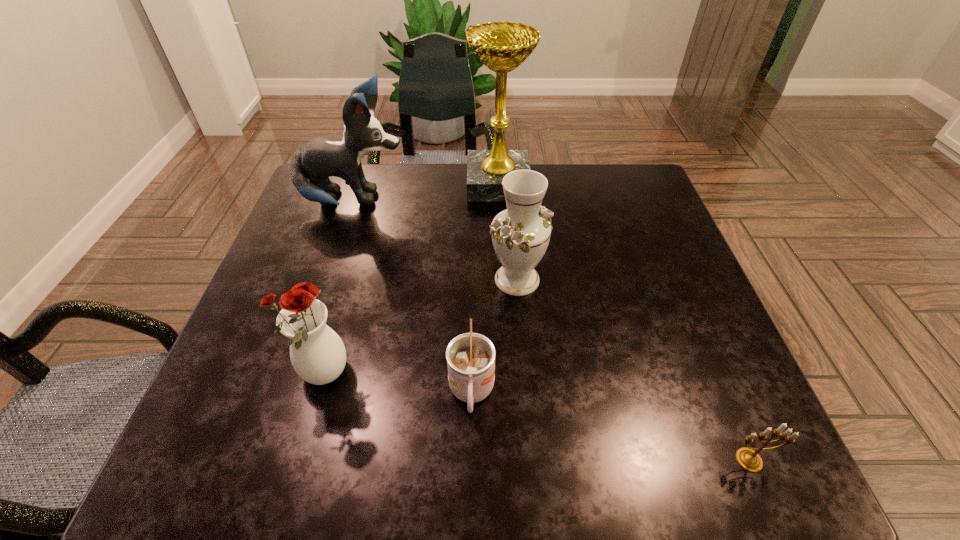
Identify the location of puppy that is positioned at the left edge. This screenshot has height=540, width=960. (313, 163).

Where is `vase that is at the left edge`? The height and width of the screenshot is (540, 960). vase that is at the left edge is located at coordinates (317, 353).

You are a GUI agent. You are given a task and a screenshot of the screen. Output one action in this format:
    pyautogui.click(x=<x>, y=<y>)
    Task: Click on the object situated at the right edge
    The image size is (960, 540).
    Given the screenshot: What is the action you would take?
    pyautogui.click(x=748, y=459)

The image size is (960, 540). Identify the location of object that is at the far left corner. tap(313, 163).

Find the location of a particular element. The height and width of the screenshot is (540, 960). object that is at the near right corner is located at coordinates (748, 459).

In the image, there is a desktop. Where is `blank space at the far edge`? This screenshot has width=960, height=540. blank space at the far edge is located at coordinates (376, 176).

Locate an element on the screen. vacant space at the near edge is located at coordinates (312, 451).

In the image, there is a desktop. At what (x,y) coordinates should I click in order to perform the action: click on vacant space at the left edge. Please return your answer as a coordinate pair (x, y). Looking at the image, I should click on (279, 376).

In the image, there is a desktop. Where is `vacant space at the right edge`? The height and width of the screenshot is (540, 960). vacant space at the right edge is located at coordinates (751, 394).

Find the location of a particular element. vacant space at the far left corner of the desktop is located at coordinates (367, 165).